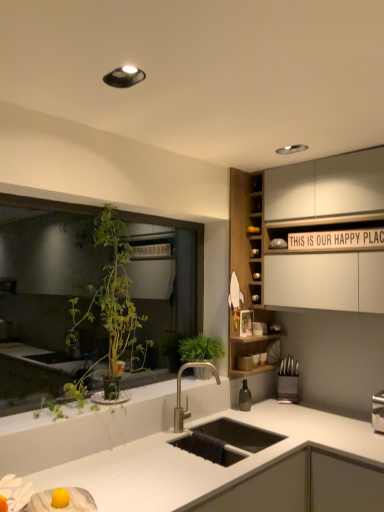
Where is `vacant region in front of black plastic knife block at right`? Image resolution: width=384 pixels, height=512 pixels. vacant region in front of black plastic knife block at right is located at coordinates (288, 410).